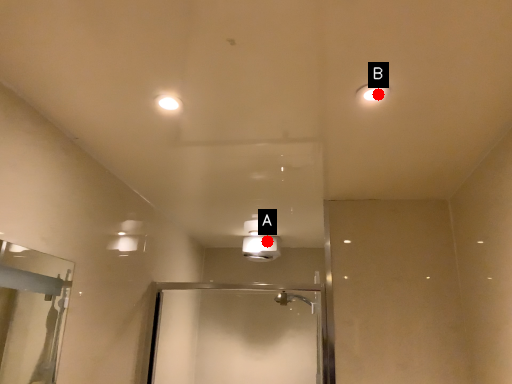
Question: Two points are circled on the image, labeled by A and B beside each circle. Which point is closer to the camera?

Choices:
 (A) A is closer
 (B) B is closer

Answer: (B)